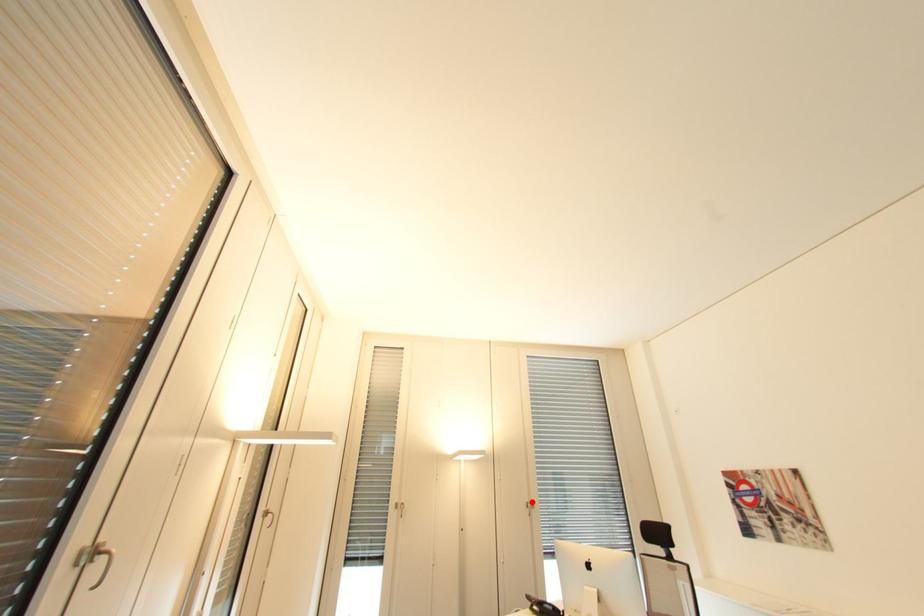
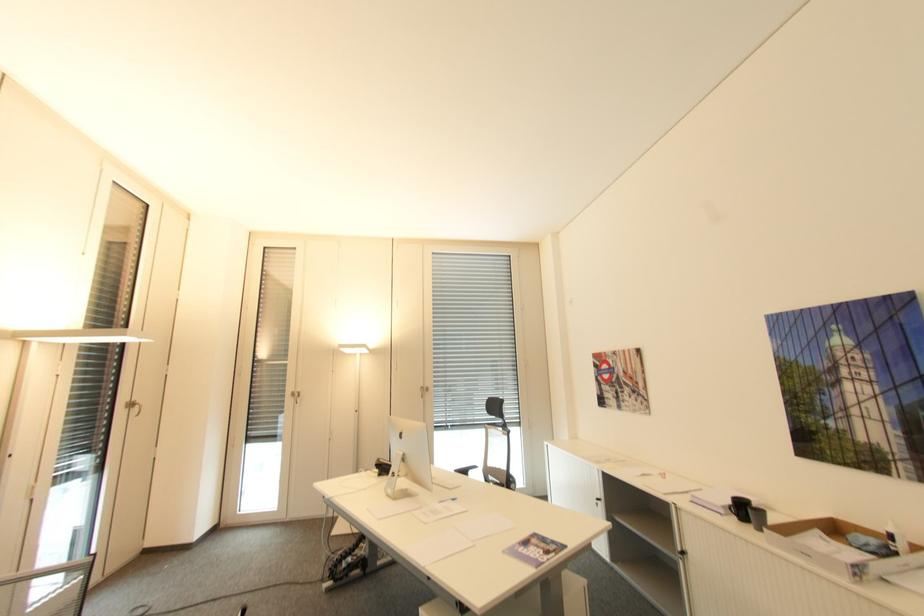
Question: I am providing you with two images of the same scene from different viewpoints. A red point is marked on the first image. At the location where the point appears in image 1, is it still visible in image 2?

Choices:
 (A) Yes
 (B) No

Answer: (A)